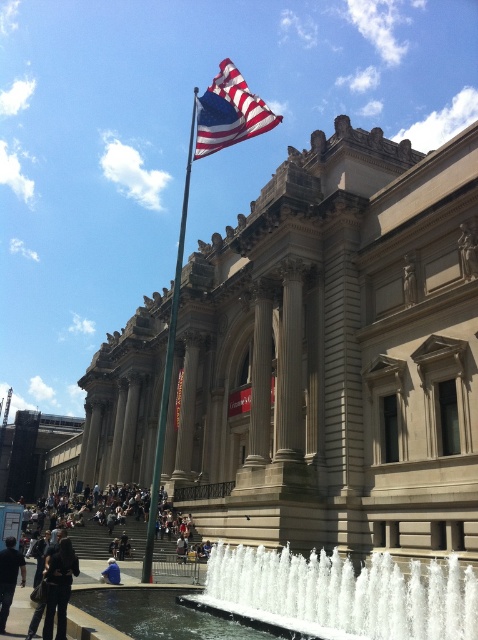
Does white water at center lie in front of white marble pillar at center?

Yes, white water at center is closer to the viewer.

Does white water at center have a greater height compared to white marble pillar at center?

Incorrect, white water at center's height is not larger of white marble pillar at center's.

Locate an element on the screen. The height and width of the screenshot is (640, 478). white water at center is located at coordinates (345, 593).

Where is `white water at center`? white water at center is located at coordinates (345, 593).

Is dark gray pants at lower left thinner than blue denim jeans at lower center?

In fact, dark gray pants at lower left might be wider than blue denim jeans at lower center.

Is dark gray pants at lower left below blue denim jeans at lower center?

No, dark gray pants at lower left is not below blue denim jeans at lower center.

Which is in front, point (2, 621) or point (110, 582)?

Positioned in front is point (2, 621).

The height and width of the screenshot is (640, 478). I want to click on dark gray pants at lower left, so click(x=9, y=577).

Is white water at center above green metallic flag pole at upper center?

No.

Is white water at center smaller than green metallic flag pole at upper center?

Correct, white water at center occupies less space than green metallic flag pole at upper center.

Locate an element on the screen. This screenshot has width=478, height=640. white water at center is located at coordinates (345, 593).